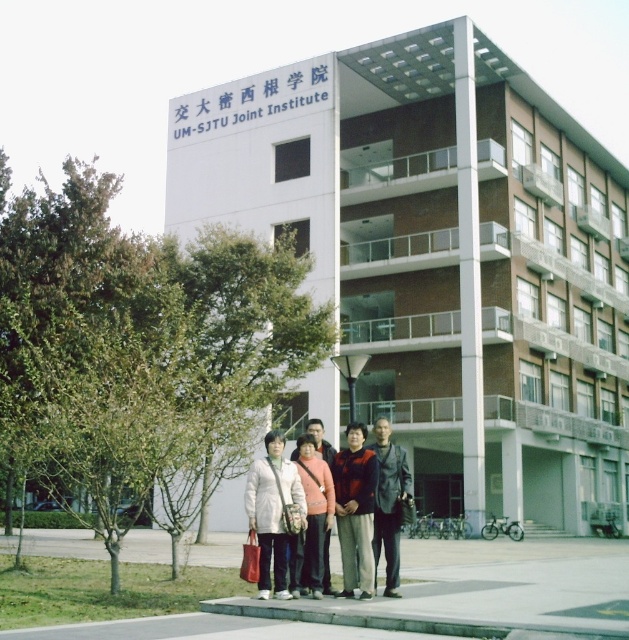
Is matte white coat at center bigger than matte pink sweater at center?

No, matte white coat at center is not bigger than matte pink sweater at center.

Is point (279, 486) farther from viewer compared to point (320, 524)?

No, (279, 486) is in front of (320, 524).

Where is `matte white coat at center`? This screenshot has width=629, height=640. matte white coat at center is located at coordinates pyautogui.click(x=274, y=513).

Measure the distance between matte white coat at center and camera.

matte white coat at center is 11.83 meters from camera.

This screenshot has height=640, width=629. Describe the element at coordinates (274, 513) in the screenshot. I see `matte white coat at center` at that location.

Describe the element at coordinates (274, 513) in the screenshot. The image size is (629, 640). I see `matte white coat at center` at that location.

At what (x,y) coordinates should I click in order to perform the action: click on matte white coat at center. Please return your answer as a coordinate pair (x, y). This screenshot has width=629, height=640. Looking at the image, I should click on point(274,513).

Which of these two, dark red sweater at center or matte pink sweater at center, stands taller?

dark red sweater at center is taller.

Is dark red sweater at center smaller than matte pink sweater at center?

Incorrect, dark red sweater at center is not smaller in size than matte pink sweater at center.

Which is in front, point (374, 472) or point (330, 506)?

Point (374, 472) is in front.

The image size is (629, 640). Identify the location of dark red sweater at center. tap(355, 509).